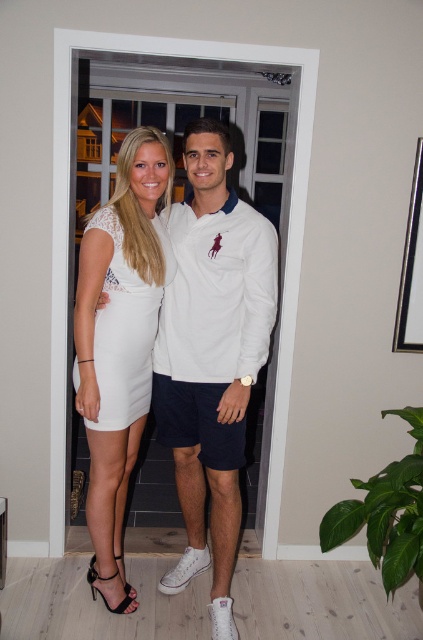
You are a fashion designer who needs to hang two dresses in a boutique display. The white matte dress at center and the white satin dress at center must be placed on adjacent hangers. Given that each hanger requires 25 centimeters of space, will both dresses fit on a single rack that is 50 centimeters wide?

The white matte dress at center is 23.48 centimeters away from the white satin dress at center. Since each hanger requires 25 centimeters and the total rack space is 50 centimeters, both dresses can fit as 25 cm x 2 equals 50 cm, which matches the rack width.

You are a photographer preparing to take a photo of two women wearing different dresses. The scene shows a woman in a white lace dress at center and another in a white satin dress at center. Which dress appears narrower when viewed from the front?

The white lace dress at center is thinner than the white satin dress at center, so the white lace dress at center appears narrower when viewed from the front.